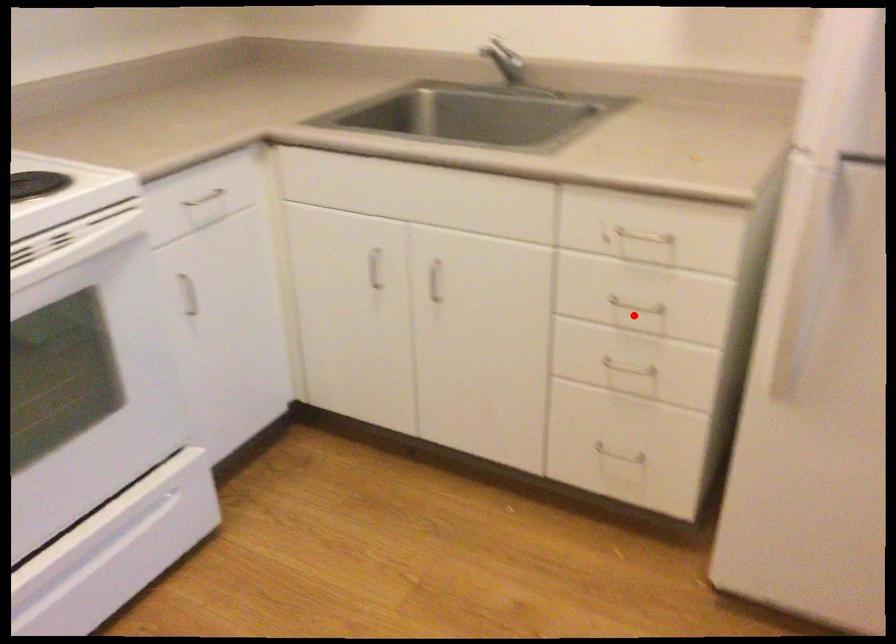
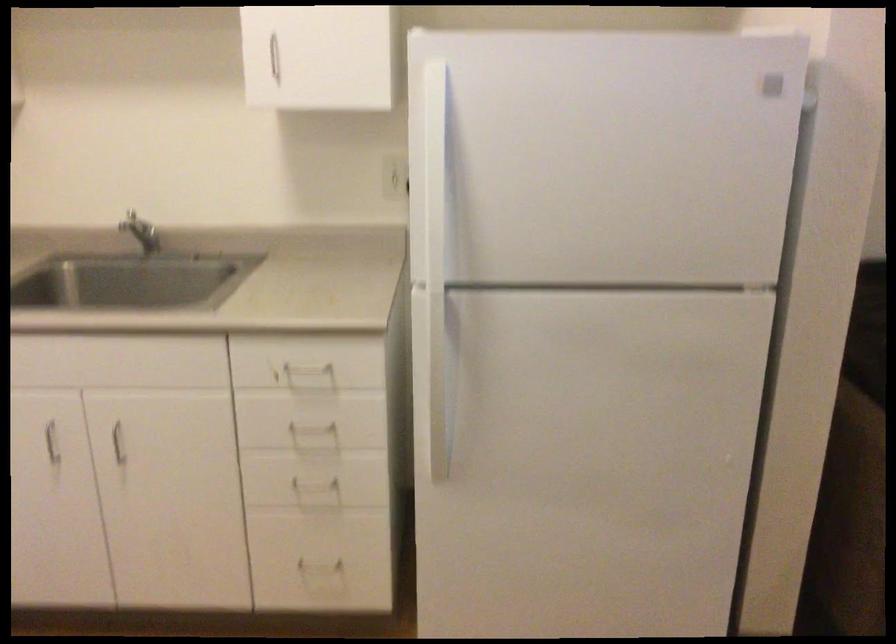
Question: I am providing you with two images of the same scene from different viewpoints. In image1, a red point is highlighted. Considering the same 3D point in image2, which of the following is correct?

Choices:
 (A) It is closer
 (B) It is farther

Answer: (B)